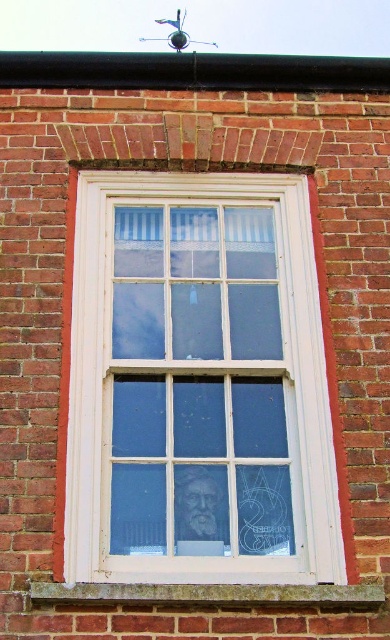
You are standing in a room with the window described. You want to place a small potted plant on the sill that is exactly at the same height as the stone at lower center. Is the window sill part of the white wood window frame at center tall enough to accommodate the plant?

The white wood window frame at center is much taller than the stone at lower center, so the window sill part of the white wood window frame at center is taller than the stone at lower center. Therefore, the plant can be placed on the sill at the same height as the stone at lower center since the sill is tall enough.